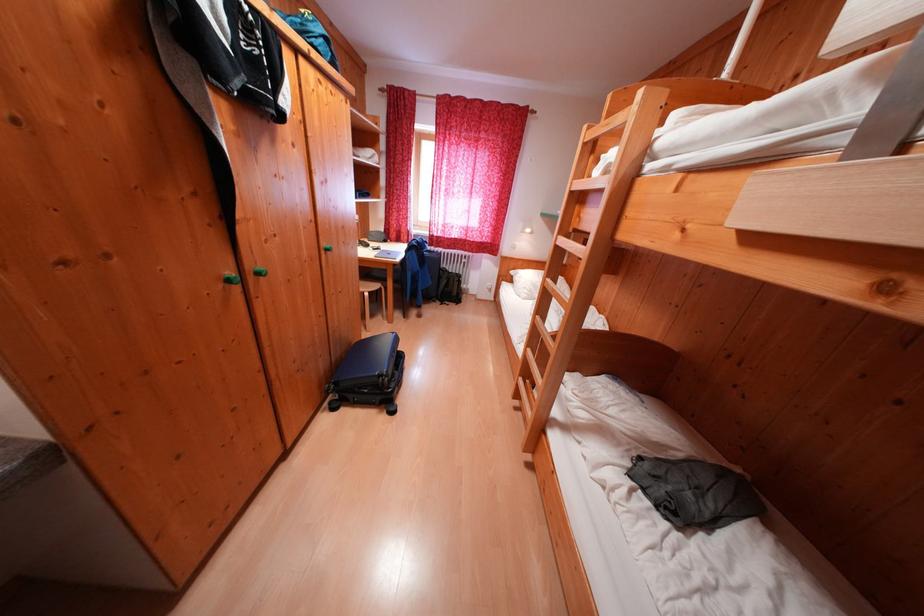
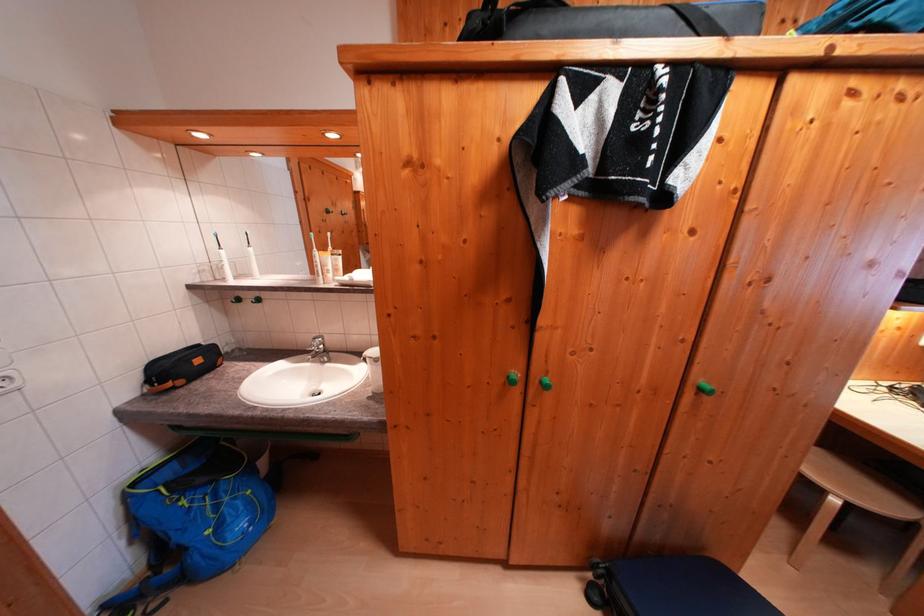
Question: I am providing you with two images of the same scene from different viewpoints. Which of the following objects are not visible in image2?

Choices:
 (A) blue backpack
 (B) black toiletry bag
 (C) green cabinet knob
 (D) none of these

Answer: (D)